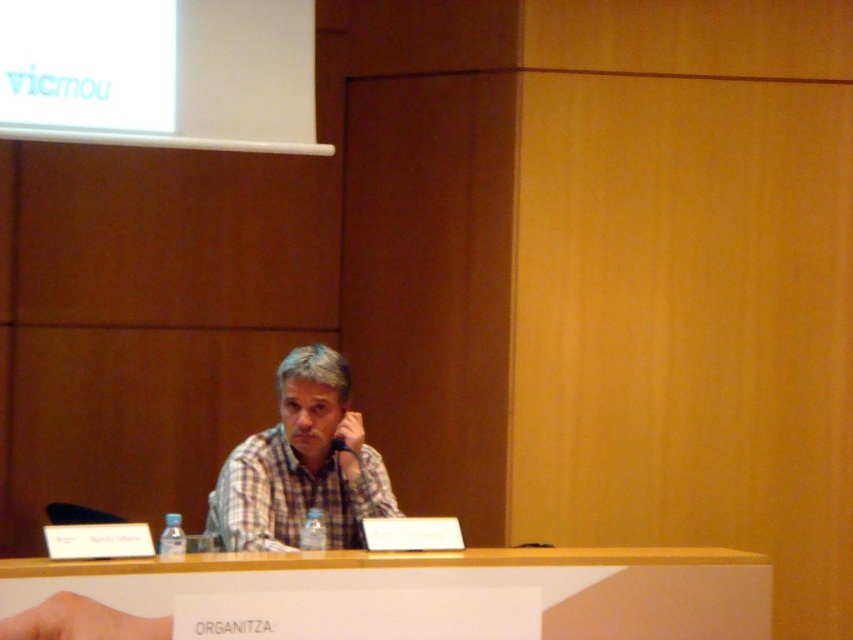
Which is above, white wood table at center or plaid fabric shirt at center?

Positioned higher is plaid fabric shirt at center.

Is white wood table at center in front of plaid fabric shirt at center?

Yes.

Which is behind, point (241, 582) or point (289, 465)?

Point (289, 465)

This screenshot has width=853, height=640. Identify the location of white wood table at center. (451, 584).